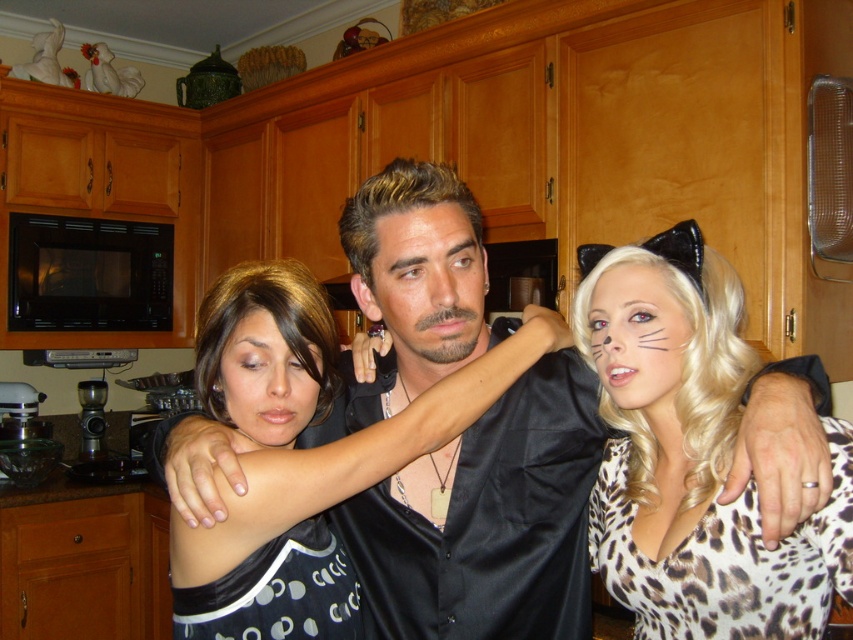
Which is more to the right, satin black dress at center or smooth skin face at center?

From the viewer's perspective, smooth skin face at center appears more on the right side.

Does point (216, 600) come farther from viewer compared to point (381, 253)?

No, (216, 600) is in front of (381, 253).

You are a GUI agent. You are given a task and a screenshot of the screen. Output one action in this format:
    pyautogui.click(x=<x>, y=<y>)
    Task: Click on the satin black dress at center
    The height and width of the screenshot is (640, 853).
    Given the screenshot: What is the action you would take?
    pyautogui.click(x=302, y=456)

Does leopard print fabric at center have a lesser height compared to satin black dress at center?

No, leopard print fabric at center is not shorter than satin black dress at center.

Is point (665, 529) positioned before point (302, 506)?

No, it is not.

Is point (752, 365) less distant than point (257, 284)?

No, (752, 365) is behind (257, 284).

Locate an element on the screen. This screenshot has height=640, width=853. leopard print fabric at center is located at coordinates (694, 461).

Is black matte microwave at left taller than smooth skin face at center?

Correct, black matte microwave at left is much taller as smooth skin face at center.

Locate an element on the screen. The width and height of the screenshot is (853, 640). black matte microwave at left is located at coordinates (88, 275).